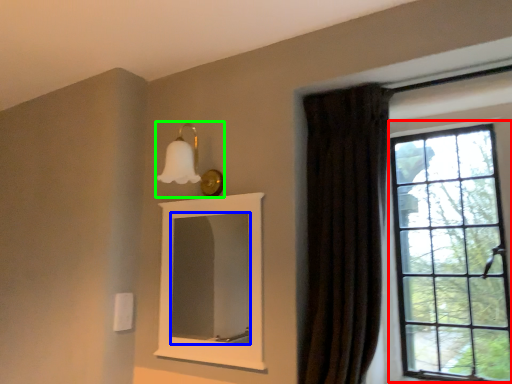
Question: Estimate the real-world distances between objects in this image. Which object is farther from window (highlighted by a red box), mirror (highlighted by a blue box) or light fixture (highlighted by a green box)?

Choices:
 (A) mirror
 (B) light fixture

Answer: (A)